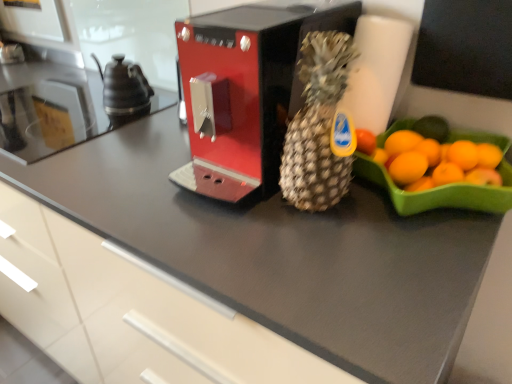
Question: Can you confirm if brown textured pineapple at center is taller than metallic red coffee machine at center?

Choices:
 (A) no
 (B) yes

Answer: (B)

Question: Is brown textured pineapple at center positioned in front of metallic red coffee machine at center?

Choices:
 (A) no
 (B) yes

Answer: (B)

Question: Are brown textured pineapple at center and metallic red coffee machine at center located far from each other?

Choices:
 (A) yes
 (B) no

Answer: (B)

Question: Is brown textured pineapple at center oriented away from metallic red coffee machine at center?

Choices:
 (A) yes
 (B) no

Answer: (B)

Question: Considering the relative positions of brown textured pineapple at center and metallic red coffee machine at center in the image provided, is brown textured pineapple at center to the left of metallic red coffee machine at center from the viewer's perspective?

Choices:
 (A) yes
 (B) no

Answer: (B)

Question: From a real-world perspective, relative to satin black countertop at left, is metallic red coffee machine at center vertically above or below?

Choices:
 (A) below
 (B) above

Answer: (B)

Question: Would you say metallic red coffee machine at center is inside or outside satin black countertop at left?

Choices:
 (A) inside
 (B) outside

Answer: (B)

Question: Is metallic red coffee machine at center taller or shorter than satin black countertop at left?

Choices:
 (A) short
 (B) tall

Answer: (B)

Question: Is metallic red coffee machine at center wider or thinner than satin black countertop at left?

Choices:
 (A) thin
 (B) wide

Answer: (B)

Question: From the image's perspective, relative to metallic red coffee machine at center, is satin black countertop at left above or below?

Choices:
 (A) below
 (B) above

Answer: (B)

Question: From a real-world perspective, is satin black countertop at left positioned above or below metallic red coffee machine at center?

Choices:
 (A) below
 (B) above

Answer: (A)

Question: Considering the relative positions of satin black countertop at left and metallic red coffee machine at center in the image provided, is satin black countertop at left to the left or to the right of metallic red coffee machine at center?

Choices:
 (A) right
 (B) left

Answer: (B)

Question: Is satin black countertop at left bigger or smaller than metallic red coffee machine at center?

Choices:
 (A) big
 (B) small

Answer: (B)

Question: Looking at their shapes, would you say black ceramic tea pot at left is wider or thinner than metallic red coffee machine at center?

Choices:
 (A) thin
 (B) wide

Answer: (A)

Question: From the image's perspective, relative to metallic red coffee machine at center, is black ceramic tea pot at left above or below?

Choices:
 (A) above
 (B) below

Answer: (A)